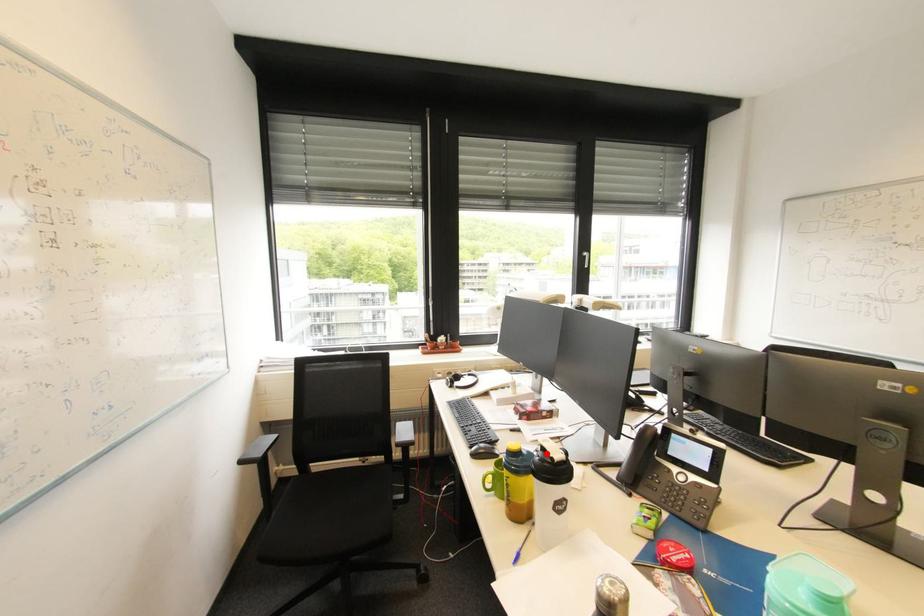
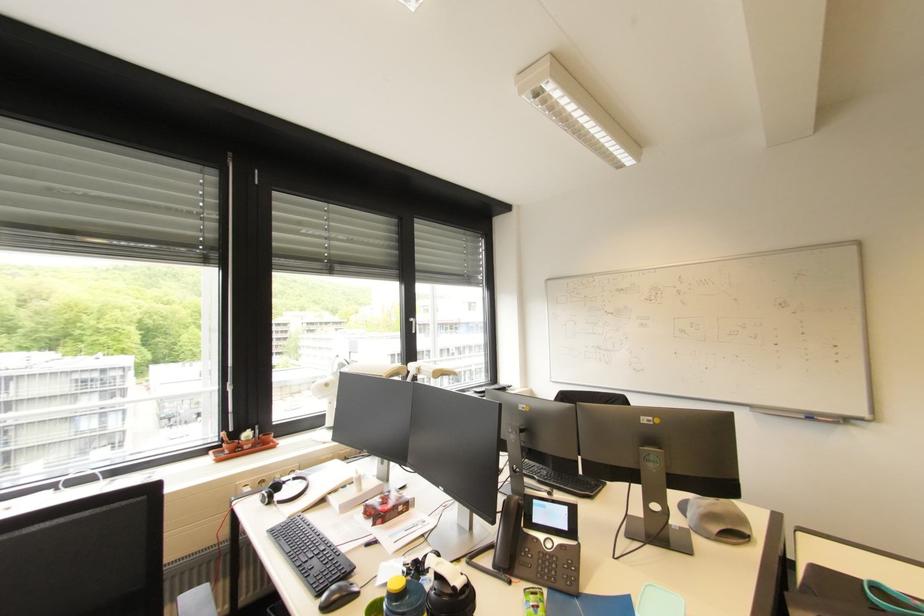
The point at the highlighted location is marked in the first image. Where is the corresponding point in the second image?

(441, 583)